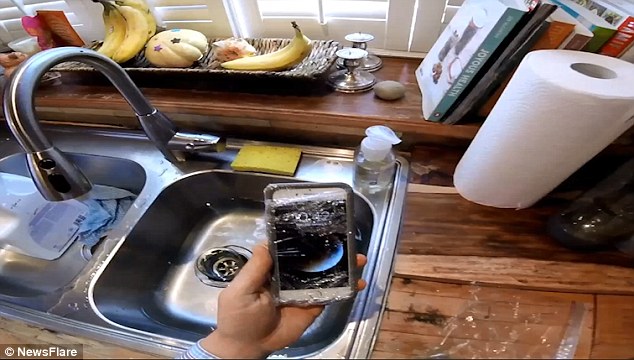
The width and height of the screenshot is (634, 360). What are the coordinates of `led` in the screenshot? It's located at (288, 216).